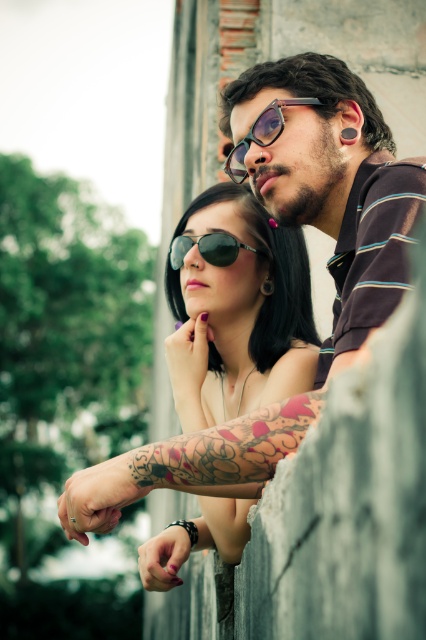
You are standing in front of the scene and want to place a small sticker exactly at the center of the image. Will the matte black sunglasses at center be directly under the sticker?

The matte black sunglasses at center is located at point (236, 308) which is very close to the center of the image, so yes, the sticker placed at the center would be directly above it.

You are a photographer standing 5 feet away from the two pairs of glasses. You want to take a photo that includes both the matte black sunglasses at upper center and the matte black glasses at center. Can you fit both into the frame without moving closer?

The distance between the matte black sunglasses at upper center and the matte black glasses at center is 18.33 inches. Since you are 5 feet away, which is 60 inches, the field of view at that distance should easily accommodate the 18.33 inch gap between them. Therefore, both can fit in the frame without moving closer.